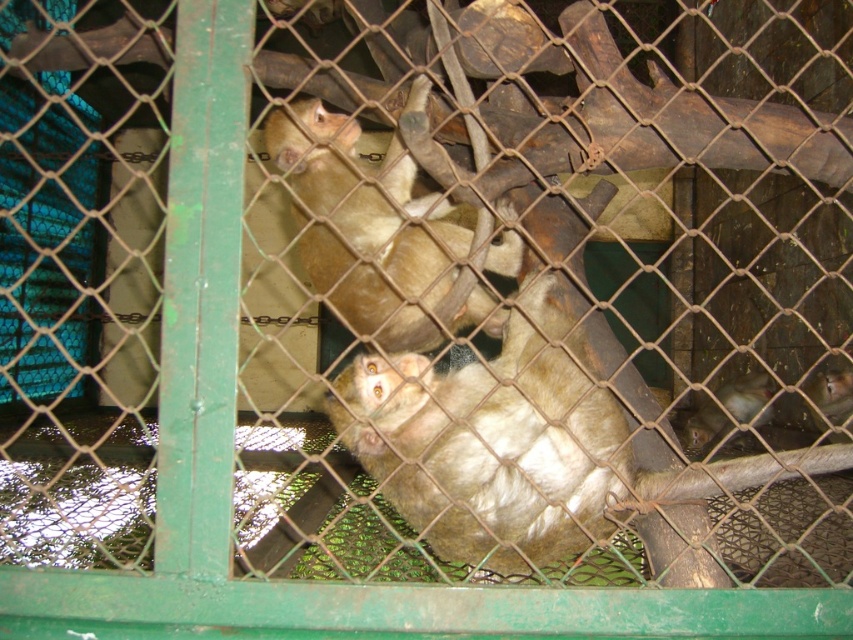
You are a zookeeper observing the monkeys in their enclosure. You need to place a banana treat between the two monkeys. Where should you position the banana so it is between the fuzzy brown monkey at center and the fuzzy brown monkey at lower right?

You should place the banana to the right of the fuzzy brown monkey at center and to the left of the fuzzy brown monkey at lower right, as the fuzzy brown monkey at center is positioned to the left of the fuzzy brown monkey at lower right.

You are standing in front of the cage and want to locate the fuzzy brown monkey at center. What are the coordinates where you can find it?

The fuzzy brown monkey at center is located at coordinates point (364, 225).

You are standing in front of the monkey enclosure and want to know how far you are from the point marked as point (106, 58). Can you determine the distance?

The distance between you and point (106, 58) is 1.96 meters.